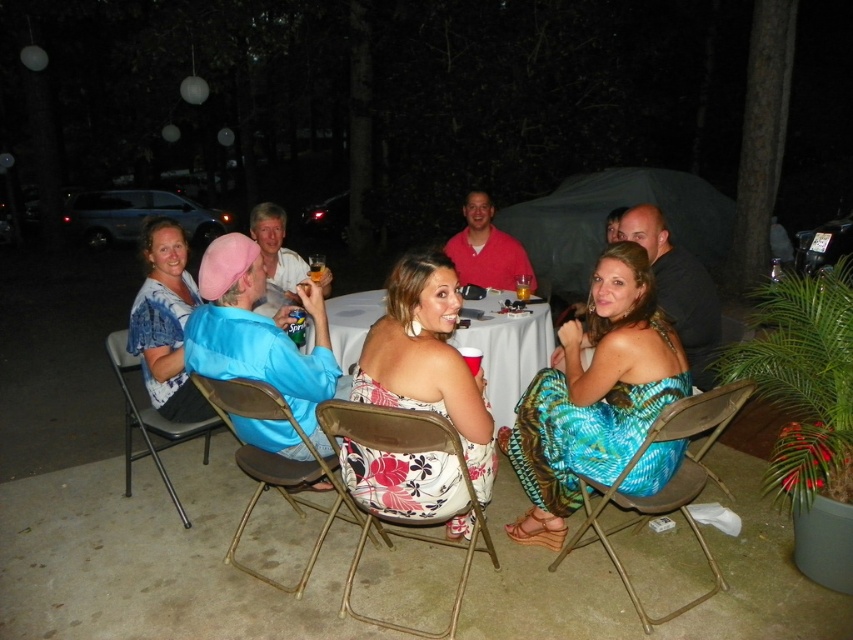
Question: Does floral fabric chair at center appear under metallic blue chair at lower left?

Choices:
 (A) no
 (B) yes

Answer: (B)

Question: Which point is farther to the camera?

Choices:
 (A) white cloth table at center
 (B) blue fabric bag at left

Answer: (A)

Question: Among these points, which one is farthest from the camera?

Choices:
 (A) (126, 403)
 (B) (659, 342)
 (C) (146, 364)
 (D) (366, 445)

Answer: (A)

Question: Which point is closer to the camera?

Choices:
 (A) (161, 316)
 (B) (364, 436)
 (C) (340, 492)

Answer: (B)

Question: Is metallic gold folding chair at center below metallic blue chair at lower left?

Choices:
 (A) yes
 (B) no

Answer: (A)

Question: Is floral fabric chair at center bigger than metallic blue chair at lower left?

Choices:
 (A) yes
 (B) no

Answer: (B)